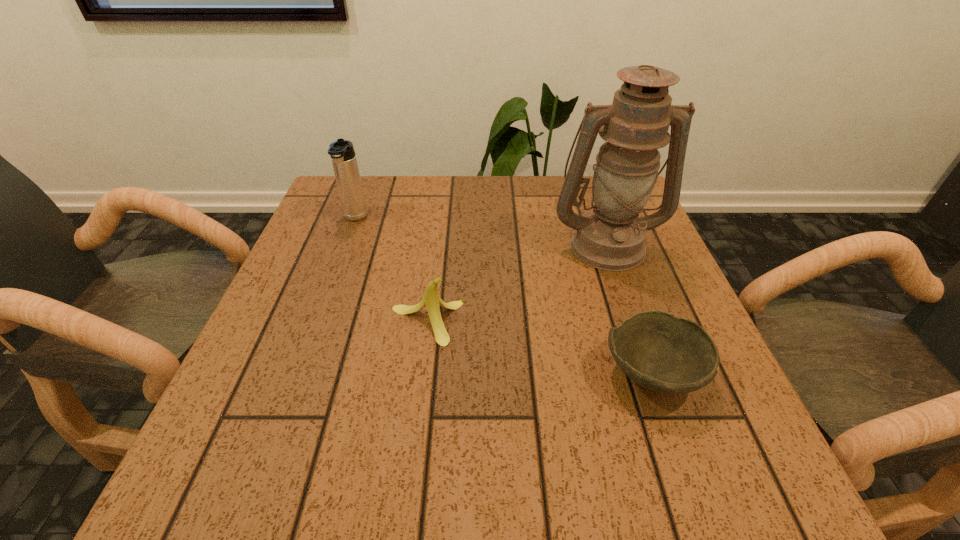
Locate an element on the screen. This screenshot has height=540, width=960. oil lamp at the far edge is located at coordinates (610, 237).

Find the location of a particular element. thermos bottle that is at the far edge is located at coordinates (344, 161).

You are a GUI agent. You are given a task and a screenshot of the screen. Output one action in this format:
    pyautogui.click(x=<x>, y=<y>)
    Task: Click on the object located in the left edge section of the desktop
    The width and height of the screenshot is (960, 540).
    Given the screenshot: What is the action you would take?
    pyautogui.click(x=344, y=161)

The image size is (960, 540). In order to click on oil lamp at the right edge in this screenshot , I will do [610, 237].

You are a GUI agent. You are given a task and a screenshot of the screen. Output one action in this format:
    pyautogui.click(x=<x>, y=<y>)
    Task: Click on the bowl that is at the right edge
    
    Given the screenshot: What is the action you would take?
    pyautogui.click(x=659, y=351)

This screenshot has height=540, width=960. Find the location of `object that is positioned at the far left corner`. object that is positioned at the far left corner is located at coordinates (344, 161).

The height and width of the screenshot is (540, 960). Identify the location of object positioned at the far right corner. (610, 237).

In the image, there is a desktop. At what (x,y) coordinates should I click in order to perform the action: click on vacant area at the far edge. Please return your answer as a coordinate pair (x, y). Looking at the image, I should click on (444, 194).

Locate an element on the screen. vacant space at the left edge is located at coordinates (306, 278).

At what (x,y) coordinates should I click in order to perform the action: click on vacant region at the far left corner of the desktop. Please return your answer as a coordinate pair (x, y). Image resolution: width=960 pixels, height=540 pixels. Looking at the image, I should click on pos(378,197).